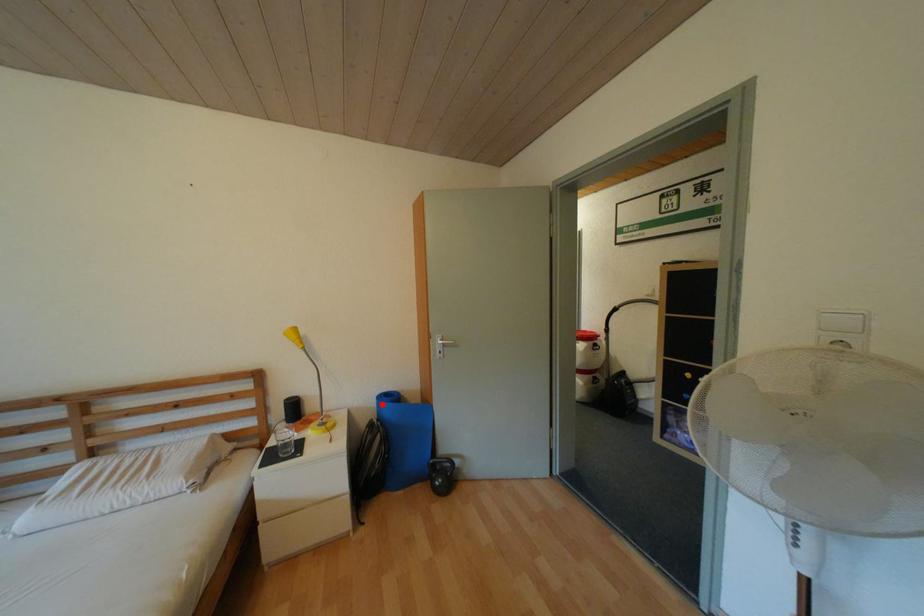
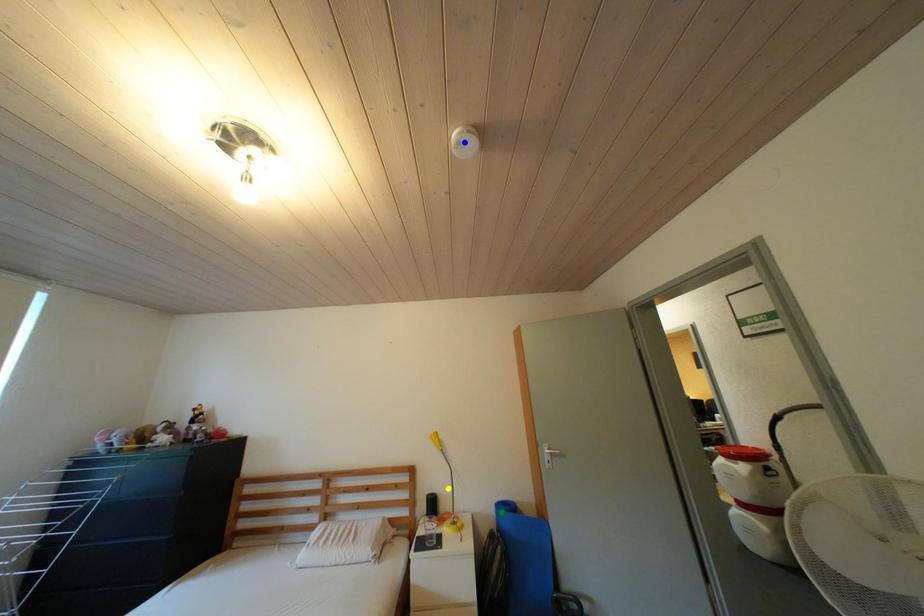
Question: I am providing you with two images of the same scene from different viewpoints. A red point is marked on the first image. You are given multiple points on the second image. Which spot in image 2 lines up with the point in image 1?

Choices:
 (A) yellow point
 (B) green point
 (C) blue point

Answer: (B)